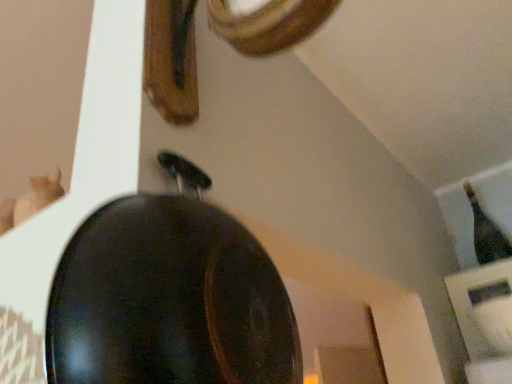
Question: In terms of width, does green glass bottle at upper right look wider or thinner when compared to shiny black frying pan at center?

Choices:
 (A) wide
 (B) thin

Answer: (A)

Question: From a real-world perspective, is green glass bottle at upper right positioned above or below shiny black frying pan at center?

Choices:
 (A) below
 (B) above

Answer: (B)

Question: Based on their sizes in the image, would you say green glass bottle at upper right is bigger or smaller than shiny black frying pan at center?

Choices:
 (A) small
 (B) big

Answer: (A)

Question: In terms of height, does shiny black frying pan at center look taller or shorter compared to green glass bottle at upper right?

Choices:
 (A) tall
 (B) short

Answer: (B)

Question: From the image's perspective, is shiny black frying pan at center located above or below green glass bottle at upper right?

Choices:
 (A) above
 (B) below

Answer: (A)

Question: Visually, is shiny black frying pan at center positioned to the left or to the right of green glass bottle at upper right?

Choices:
 (A) left
 (B) right

Answer: (A)

Question: Is shiny black frying pan at center inside or outside of green glass bottle at upper right?

Choices:
 (A) outside
 (B) inside

Answer: (A)